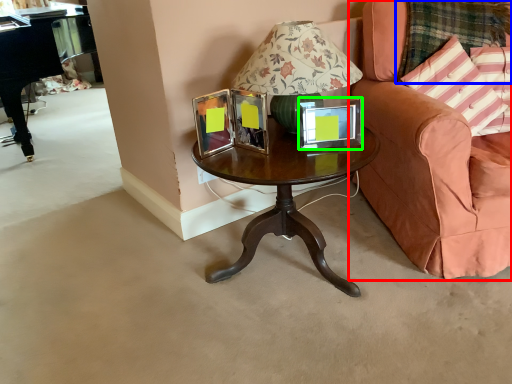
Question: Based on their relative distances, which object is nearer to chair (highlighted by a red box)? Choose from plaid (highlighted by a blue box) and picture frame (highlighted by a green box).

Choices:
 (A) plaid
 (B) picture frame

Answer: (A)